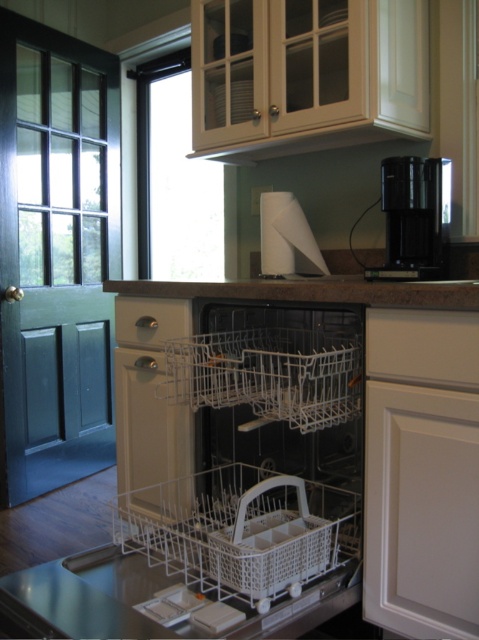
Identify the location of white plastic basket at center. (240, 531).

In the scene shown: Between white plastic basket at center and brown granite countertop at center, which one is positioned higher?

brown granite countertop at center is higher up.

Find the location of a particular element. This screenshot has width=479, height=640. white plastic basket at center is located at coordinates (240, 531).

Can you confirm if white plastic basket at center is positioned to the left of black plastic coffee machine at upper right?

Yes, white plastic basket at center is to the left of black plastic coffee machine at upper right.

Between white plastic basket at center and black plastic coffee machine at upper right, which one appears on the right side from the viewer's perspective?

Positioned to the right is black plastic coffee machine at upper right.

You are a GUI agent. You are given a task and a screenshot of the screen. Output one action in this format:
    pyautogui.click(x=<x>, y=<y>)
    Task: Click on the white plastic basket at center
    
    Given the screenshot: What is the action you would take?
    pyautogui.click(x=240, y=531)

Does white plastic dish washer at center lie in front of brown granite countertop at center?

Yes, white plastic dish washer at center is in front of brown granite countertop at center.

Who is more distant from viewer, (x=216, y=474) or (x=149, y=285)?

The point (x=149, y=285) is more distant.

Does point (152, 436) come farther from viewer compared to point (192, 288)?

That is True.

Locate an element on the screen. The image size is (479, 640). white plastic dish washer at center is located at coordinates (239, 444).